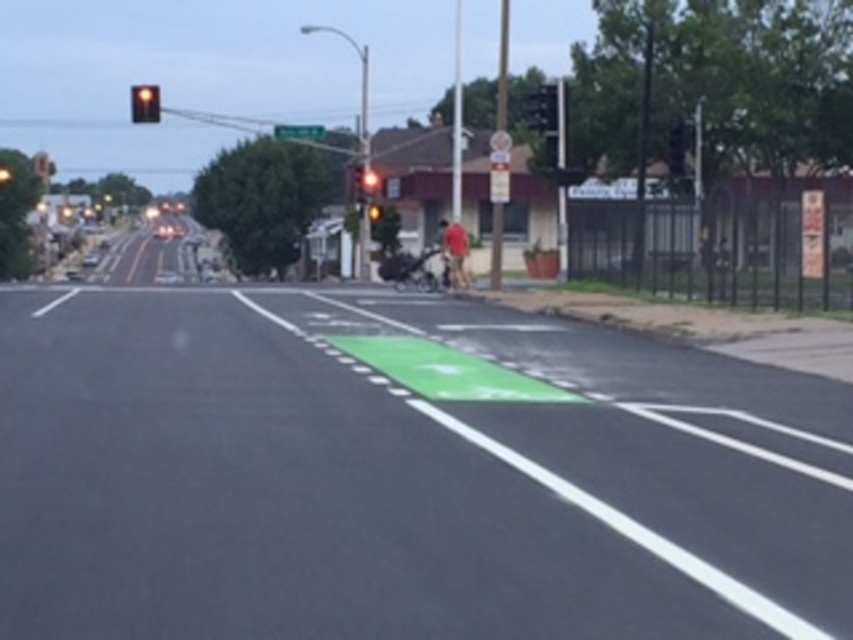
Does point (741, 627) come farther from viewer compared to point (502, 70)?

No, (741, 627) is closer to viewer.

Does point (637, 609) come behind point (490, 260)?

No, it is not.

Find the location of a particular element. This screenshot has width=853, height=640. green asphalt at center is located at coordinates (403, 474).

Consider the image. Which is above, amber glass traffic light at upper center or green plastic street sign at upper center?

Positioned higher is amber glass traffic light at upper center.

Which is more to the left, amber glass traffic light at upper center or green plastic street sign at upper center?

Positioned to the left is amber glass traffic light at upper center.

You are a GUI agent. You are given a task and a screenshot of the screen. Output one action in this format:
    pyautogui.click(x=<x>, y=<y>)
    Task: Click on the amber glass traffic light at upper center
    
    Given the screenshot: What is the action you would take?
    pyautogui.click(x=144, y=104)

Can you confirm if metallic pole at right is wider than green plastic street sign at upper center?

Yes, metallic pole at right is wider than green plastic street sign at upper center.

Is metallic pole at right in front of green plastic street sign at upper center?

Yes.

The image size is (853, 640). I want to click on metallic pole at right, so click(502, 65).